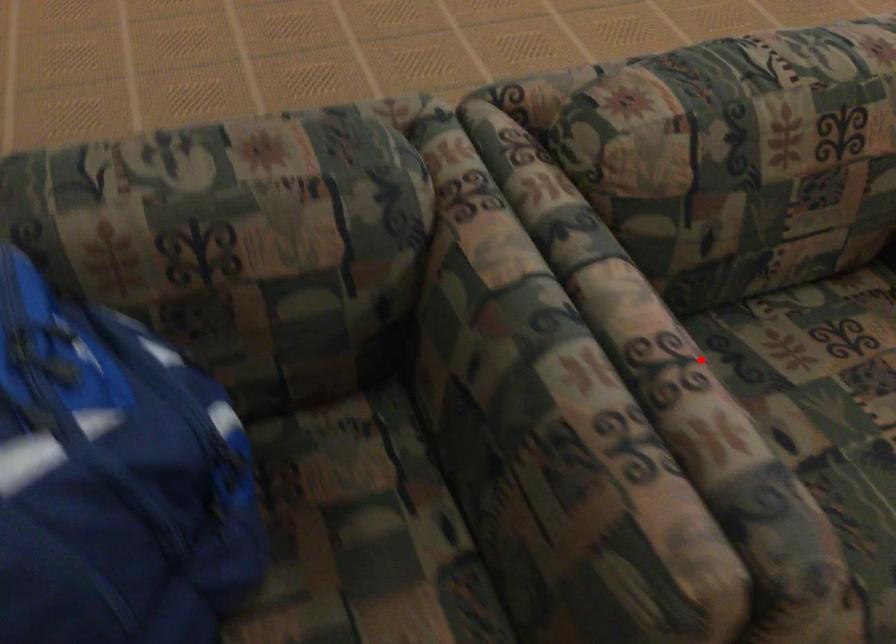
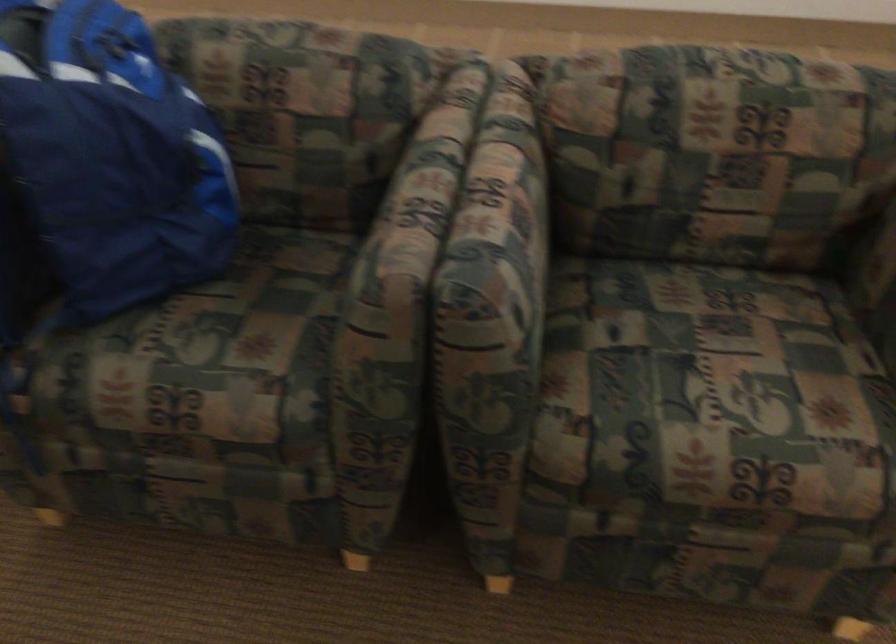
Question: I am providing you with two images of the same scene from different viewpoints. Given a red point in image1, look at the same physical point in image2. Is it:

Choices:
 (A) Closer to the viewpoint
 (B) Farther from the viewpoint

Answer: (B)